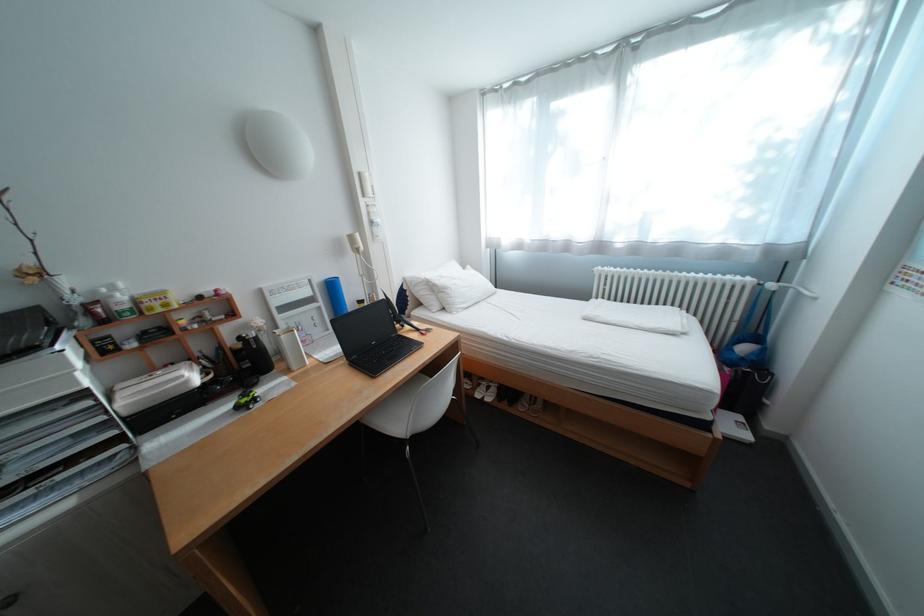
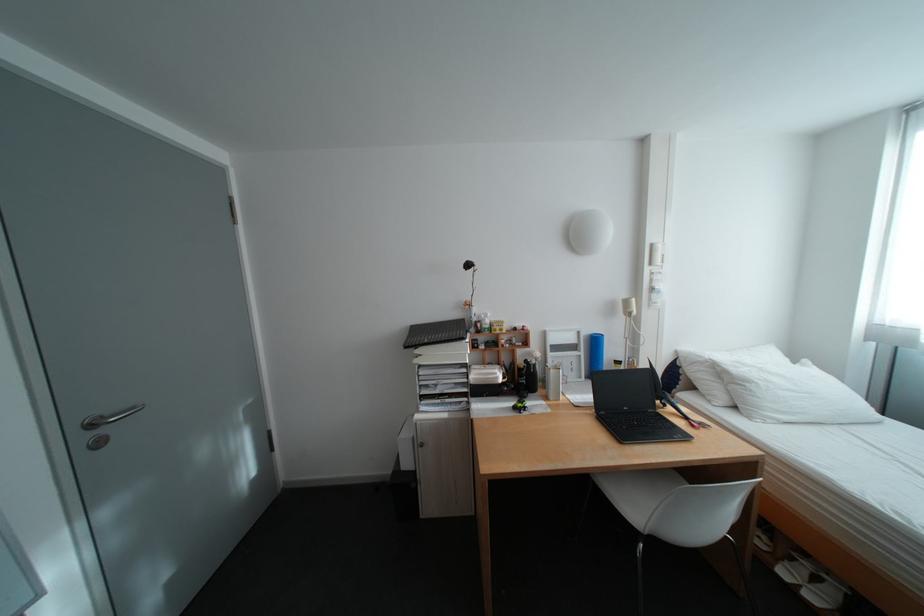
Find the pixel in the second image that matches [100,390] in the first image.

(480, 363)